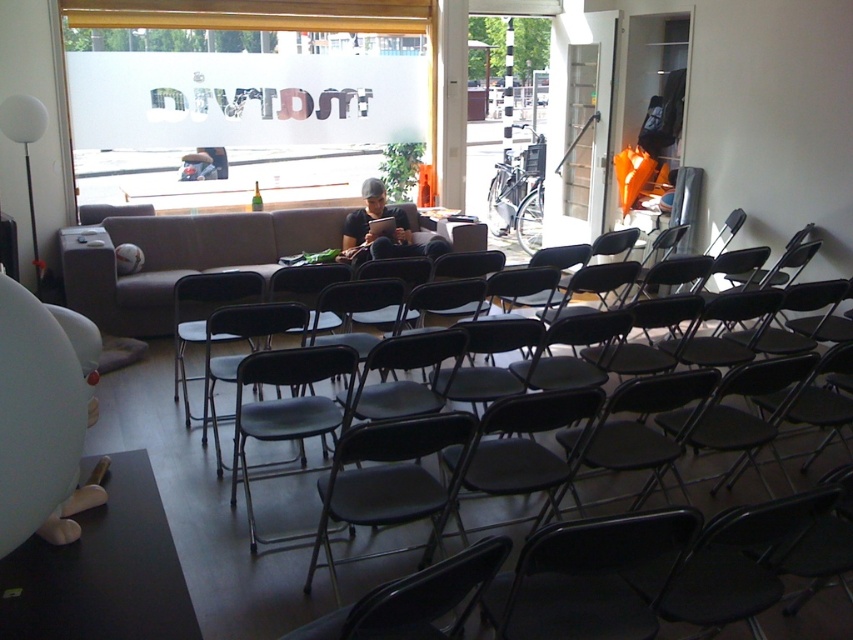
You are standing in the meeting room and want to reach a specific point marked at coordinates point [175,289]. If you are currently 5 meters away from that point, how much closer do you need to move to be exactly at the point?

The distance of point [175,289] from camera is 3.83 meters. Since you are currently 5 meters away, you need to move 1.17 meters closer to reach the point.

You are organizing a workshop and need to seat 10 people. You have a limited space where the total width available is 3 meters. The matte black chair at center takes up 0.4 meters of space per chair, while the black metal folding chair at center requires 0.6 meters per chair. If you want to maximize the number of attendees without exceeding the space, which chair should you choose and why?

The matte black chair at center is smaller than the black metal folding chair at center. To maximize the number of attendees within 3 meters, choose the matte black chair at center since each takes up less space. 3 meters divided by 0.4 meters per chair equals 7.5 chairs, so you can fit 7 chairs. Using the black metal folding chair at center would only allow 5 chairs.